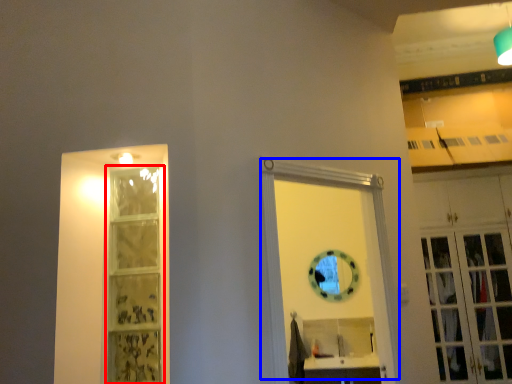
Question: Which object appears closest to the camera in this image, shelf (highlighted by a red box) or door (highlighted by a blue box)?

Choices:
 (A) shelf
 (B) door

Answer: (B)